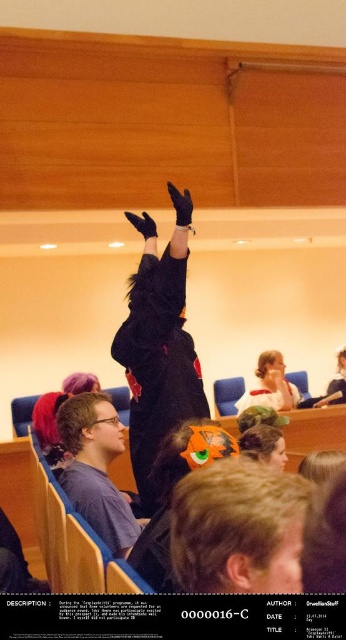
You are organizing a small event in this lecture hall and need to place a 2.5 meter long banner between the black plush at center and the smooth plastic spoon at lower center. Is there enough space to fit the banner between them?

The black plush at center is 2.11 meters away from the smooth plastic spoon at lower center. Since the banner is 2.5 meters long, which is longer than the distance between them, there isn not enough space to fit the banner between them.

You are a photographer in the lecture hall and want to capture a photo of both the blonde hair at center and the black plush at center. Which object should you focus on first if you want to ensure both are in the frame without moving the camera?

You should focus on the black plush at center first because it is taller than the blonde hair at center, so positioning the camera to include its height will naturally include the shorter blonde hair at center as well.

Please look at the point marked as point (159, 346) in the image. What object is located at this point?

The black plush at center is located at point (159, 346).